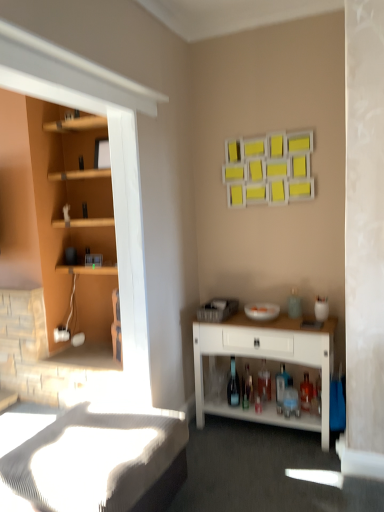
Question: Considering their positions, is translucent glass bottle at lower center, which is the 4th bottle in front-to-back order, located in front of or behind white wood desk at lower right?

Choices:
 (A) front
 (B) behind

Answer: (B)

Question: In the image, is translucent glass bottle at lower center, which is the 4th bottle in front-to-back order, on the left side or the right side of white wood desk at lower right?

Choices:
 (A) right
 (B) left

Answer: (B)

Question: Estimate the real-world distances between objects in this image. Which object is closer to the translucent glass bottle at lower center, which is the 4th bottle in front-to-back order?

Choices:
 (A) transparent glass bottle at center, placed as the third bottle when sorted from back to front
 (B) white wood desk at lower right
 (C) translucent glass bottle at lower center, arranged as the first bottle when viewed from the right
 (D) translucent glass bottle at lower center, which is the 3th bottle in left-to-right order
 (E) white textured bed frame at lower left

Answer: (A)

Question: Based on their relative distances, which object is farther from the white wood desk at lower right?

Choices:
 (A) translucent glass bottle at lower center, the 4th bottle when ordered from left to right
 (B) white textured bed frame at lower left
 (C) translucent glass bottle at lower center, which is the 3th bottle in left-to-right order
 (D) transparent glass bottle at center, the second bottle in the front-to-back sequence
 (E) translucent glass bottle at lower center, the second bottle positioned from the left

Answer: (B)